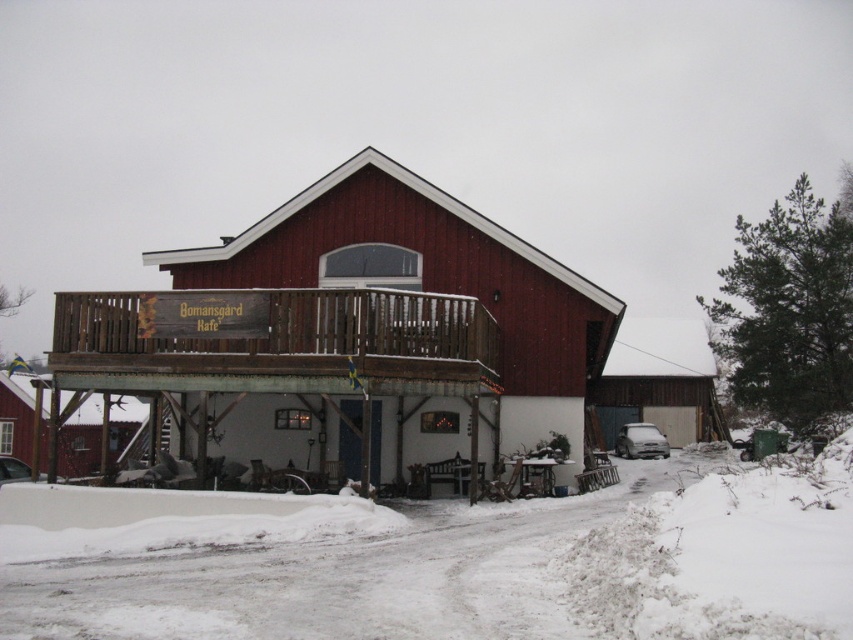
Does point (404, 179) come closer to viewer compared to point (503, 560)?

No, it is behind (503, 560).

Measure the distance between matte red barn at center and camera.

They are 50.29 feet apart.

What are the coordinates of `matte red barn at center` in the screenshot? It's located at (351, 332).